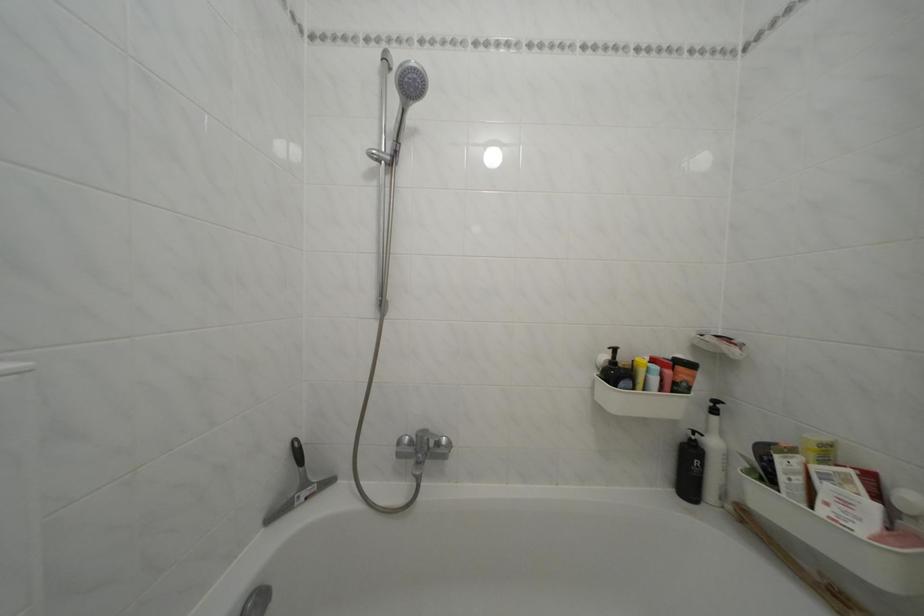
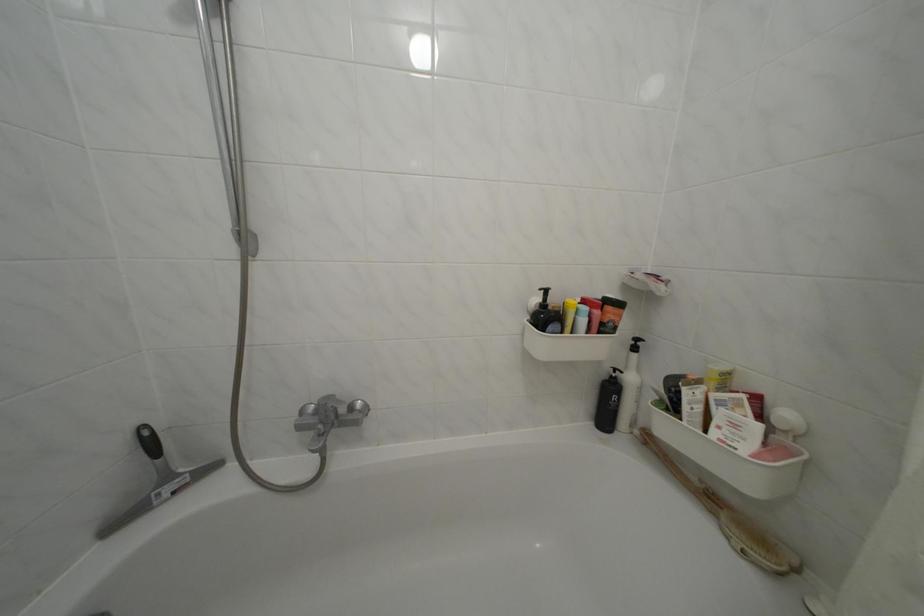
In a continuous first-person perspective shot, in which direction is the camera moving?

The cameraman moved toward right, forward.